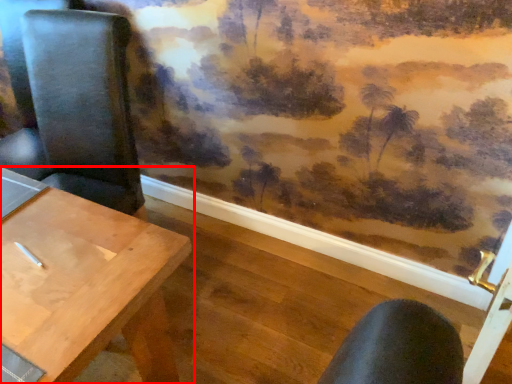
Question: Observing the image, what is the correct spatial positioning of table (annotated by the red box) in reference to chair?

Choices:
 (A) right
 (B) left

Answer: (B)